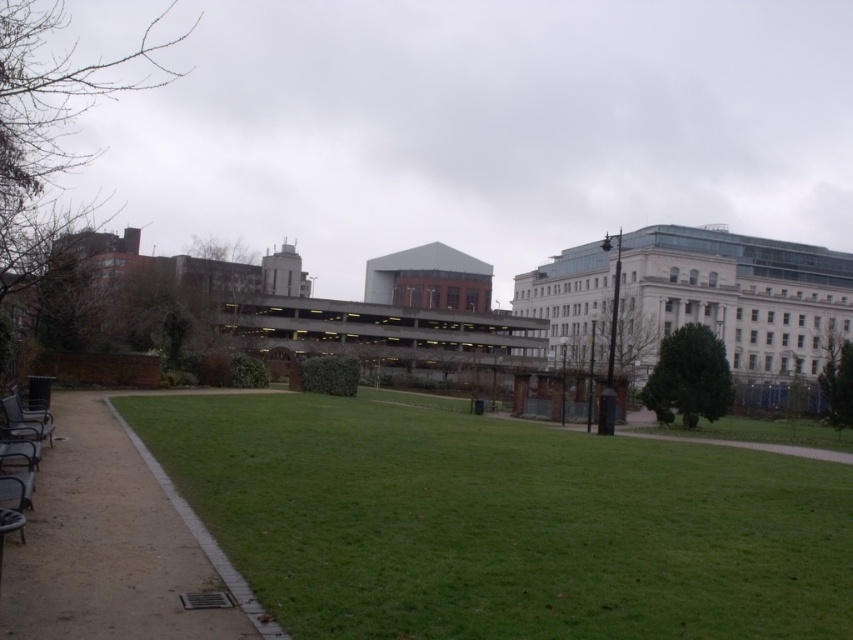
Question: Which object is farther from the camera taking this photo?

Choices:
 (A) green grass at center
 (B) metallic silver bench at lower left

Answer: (B)

Question: Can you confirm if brown gravel path at lower left is smaller than metallic silver bench at lower left?

Choices:
 (A) yes
 (B) no

Answer: (B)

Question: Can you confirm if green grass at center is positioned to the right of brown gravel path at lower left?

Choices:
 (A) yes
 (B) no

Answer: (A)

Question: Does green grass at center lie in front of metallic silver bench at lower left?

Choices:
 (A) no
 (B) yes

Answer: (B)

Question: Among these objects, which one is nearest to the camera?

Choices:
 (A) brown gravel path at lower left
 (B) metallic silver bench at lower left

Answer: (A)

Question: Which point is farther from the camera taking this photo?

Choices:
 (A) (187, 420)
 (B) (35, 420)
 (C) (190, 547)

Answer: (A)